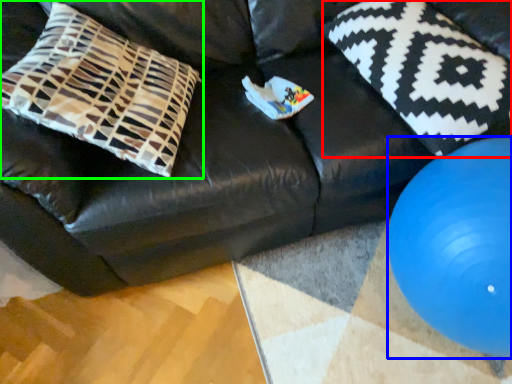
Question: Based on their relative distances, which object is farther from pillow (highlighted by a red box)? Choose from ball (highlighted by a blue box) and pillow (highlighted by a green box).

Choices:
 (A) ball
 (B) pillow

Answer: (B)